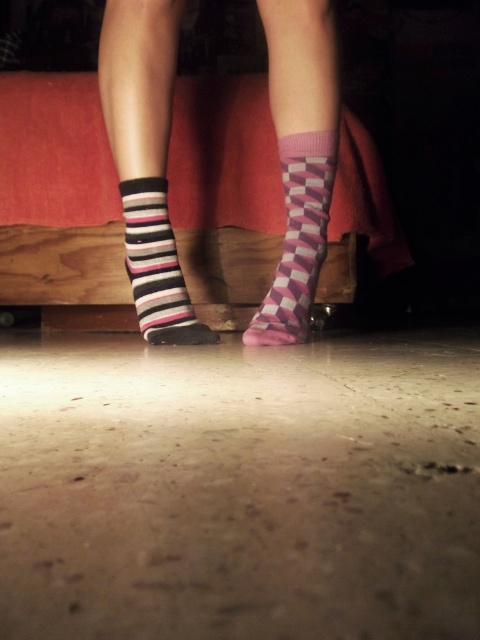
You are trying to decide which sock to wear for a casual day out. The pink checkered sock at center and the striped cotton sock at left are options. Based on their widths, which sock would be more comfortable for walking long distances?

The striped cotton sock at left has a greater width than the pink checkered sock at center, making it more comfortable for walking long distances due to better support.

You are a delivery robot with a package that needs to be placed between the pink checkered sock at center and the matte black shoe at center. The package is 12 inches long. Can you fit it between them?

The distance between the pink checkered sock at center and the matte black shoe at center is 10.79 inches. Since the package is 12 inches long, it cannot fit between them as the space is smaller than the package.